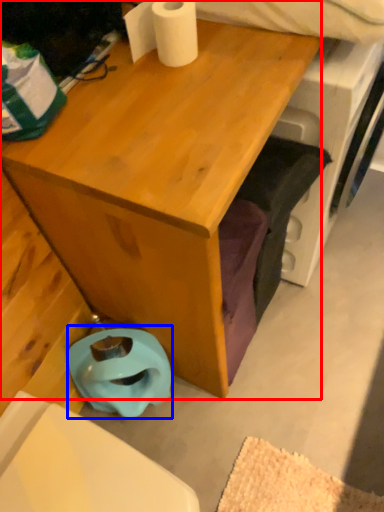
Question: Which object is closer to the camera taking this photo, desk (highlighted by a red box) or toilet bowl (highlighted by a blue box)?

Choices:
 (A) desk
 (B) toilet bowl

Answer: (A)